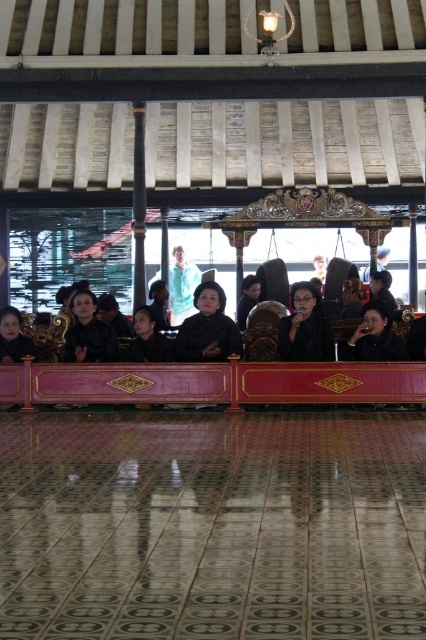
Question: Is black matte jacket at center to the left of black glossy hair at center from the viewer's perspective?

Choices:
 (A) no
 (B) yes

Answer: (A)

Question: Is matte black jacket at lower right bigger than light blue fabric at center?

Choices:
 (A) no
 (B) yes

Answer: (A)

Question: Can you confirm if light blue fabric at center is wider than black glossy hair at center?

Choices:
 (A) yes
 (B) no

Answer: (A)

Question: Which point is farther to the camera?

Choices:
 (A) polished wood rail at center
 (B) black glossy hair at center

Answer: (B)

Question: Which point appears farthest from the camera in this image?

Choices:
 (A) (402, 392)
 (B) (250, 301)
 (C) (302, 321)
 (D) (382, 348)

Answer: (B)

Question: Which point is farther to the camera?

Choices:
 (A) black glossy hair at center
 (B) black matte jacket at center
 (C) light blue fabric at center
 (D) polished wood rail at center

Answer: (C)